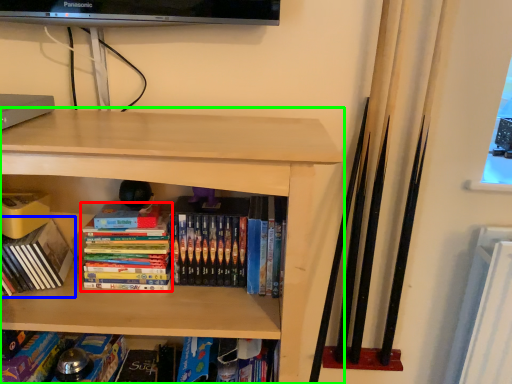
Question: Which object is the closest to the book (highlighted by a red box)? Choose among these: book (highlighted by a blue box) or shelf (highlighted by a green box).

Choices:
 (A) book
 (B) shelf

Answer: (A)